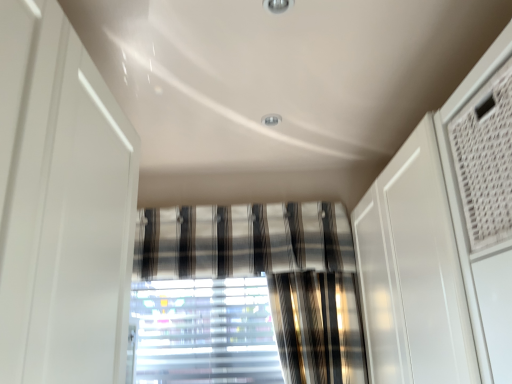
This screenshot has height=384, width=512. What do you see at coordinates (242, 240) in the screenshot? I see `striped fabric curtain at center` at bounding box center [242, 240].

Measure the distance between striped fabric curtain at center and camera.

The distance of striped fabric curtain at center from camera is 1.93 meters.

I want to click on striped fabric curtain at center, so click(242, 240).

In order to face striped fabric curtain at center, should I rotate leftwards or rightwards?

To face it directly, rotate left by 2.058 degrees.

Measure the distance between point (170, 245) and camera.

They are 6.58 feet apart.

This screenshot has width=512, height=384. What do you see at coordinates (204, 332) in the screenshot?
I see `translucent plastic blinds at center` at bounding box center [204, 332].

Identify the location of translucent plastic blinds at center. (204, 332).

I want to click on striped fabric curtain at center, so click(x=242, y=240).

Does translucent plastic blinds at center appear on the right side of striped fabric curtain at center?

No.

Is translucent plastic blinds at center positioned in front of striped fabric curtain at center?

No, translucent plastic blinds at center is behind striped fabric curtain at center.

Which is in front, point (189, 283) or point (199, 272)?

Point (199, 272)

From the image's perspective, is translucent plastic blinds at center on striped fabric curtain at center?

No, from the image's perspective, translucent plastic blinds at center is not over striped fabric curtain at center.

From a real-world perspective, does translucent plastic blinds at center stand above striped fabric curtain at center?

No.

Does translucent plastic blinds at center have a lesser width compared to striped fabric curtain at center?

Yes.

Does translucent plastic blinds at center have a greater height compared to striped fabric curtain at center?

Correct, translucent plastic blinds at center is much taller as striped fabric curtain at center.

Who is smaller, translucent plastic blinds at center or striped fabric curtain at center?

With smaller size is translucent plastic blinds at center.

Is translucent plastic blinds at center inside the boundaries of striped fabric curtain at center, or outside?

translucent plastic blinds at center exists outside the volume of striped fabric curtain at center.

Are translucent plastic blinds at center and striped fabric curtain at center beside each other?

No, translucent plastic blinds at center is not with striped fabric curtain at center.

Does translucent plastic blinds at center turn towards striped fabric curtain at center?

No, translucent plastic blinds at center is not aimed at striped fabric curtain at center.

Locate an element on the screen. This screenshot has width=512, height=384. curtain that is above the translucent plastic blinds at center (from a real-world perspective) is located at coordinates (242, 240).

Can you confirm if striped fabric curtain at center is positioned to the right of translucent plastic blinds at center?

Yes, striped fabric curtain at center is to the right of translucent plastic blinds at center.

Is striped fabric curtain at center further to the viewer compared to translucent plastic blinds at center?

No, striped fabric curtain at center is closer to the viewer.

Between point (296, 250) and point (216, 304), which one is positioned in front?

The point (296, 250) is closer.

From the image's perspective, is striped fabric curtain at center beneath translucent plastic blinds at center?

No, from the image's perspective, striped fabric curtain at center is not beneath translucent plastic blinds at center.

From a real-world perspective, is striped fabric curtain at center located beneath translucent plastic blinds at center?

No, from a real-world perspective, striped fabric curtain at center is not below translucent plastic blinds at center.

Can you confirm if striped fabric curtain at center is thinner than translucent plastic blinds at center?

No, striped fabric curtain at center is not thinner than translucent plastic blinds at center.

Which of these two, striped fabric curtain at center or translucent plastic blinds at center, stands shorter?

striped fabric curtain at center is shorter.

Between striped fabric curtain at center and translucent plastic blinds at center, which one has smaller size?

With smaller size is translucent plastic blinds at center.

Do you think striped fabric curtain at center is within translucent plastic blinds at center, or outside of it?

striped fabric curtain at center cannot be found inside translucent plastic blinds at center.

Are striped fabric curtain at center and translucent plastic blinds at center making contact?

striped fabric curtain at center and translucent plastic blinds at center are clearly separated.

Is striped fabric curtain at center facing towards translucent plastic blinds at center?

No, striped fabric curtain at center is not oriented towards translucent plastic blinds at center.

How distant is striped fabric curtain at center from translucent plastic blinds at center?

They are 11.19 inches apart.

Find the location of a particular element. The height and width of the screenshot is (384, 512). window below the striped fabric curtain at center (from the image's perspective) is located at coordinates (204, 332).

Find the location of a particular element. The image size is (512, 384). curtain on the right of translucent plastic blinds at center is located at coordinates (242, 240).

The image size is (512, 384). What are the coordinates of `curtain above the translucent plastic blinds at center (from a real-world perspective)` in the screenshot? It's located at (242, 240).